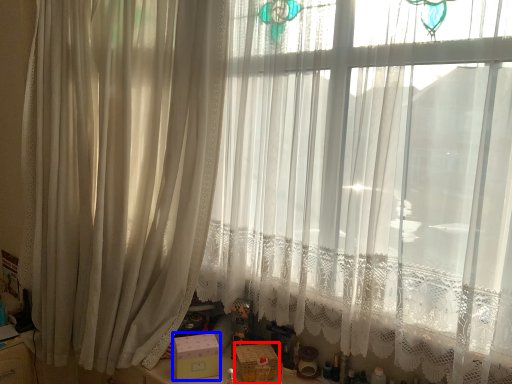
Question: Among these objects, which one is nearest to the camera, box (highlighted by a red box) or box (highlighted by a blue box)?

Choices:
 (A) box
 (B) box

Answer: (A)